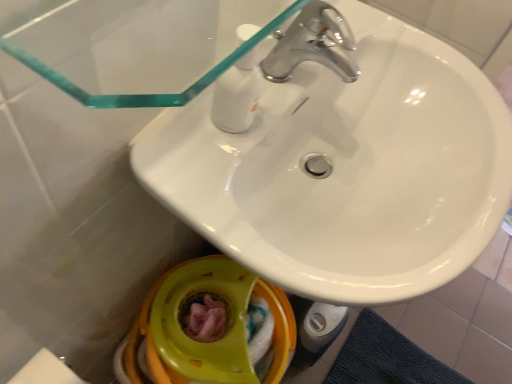
Where is `free point above matte yellow plastic toilet bowl at lower center (from a real-world perspective)`? Image resolution: width=512 pixels, height=384 pixels. free point above matte yellow plastic toilet bowl at lower center (from a real-world perspective) is located at coordinates (190, 327).